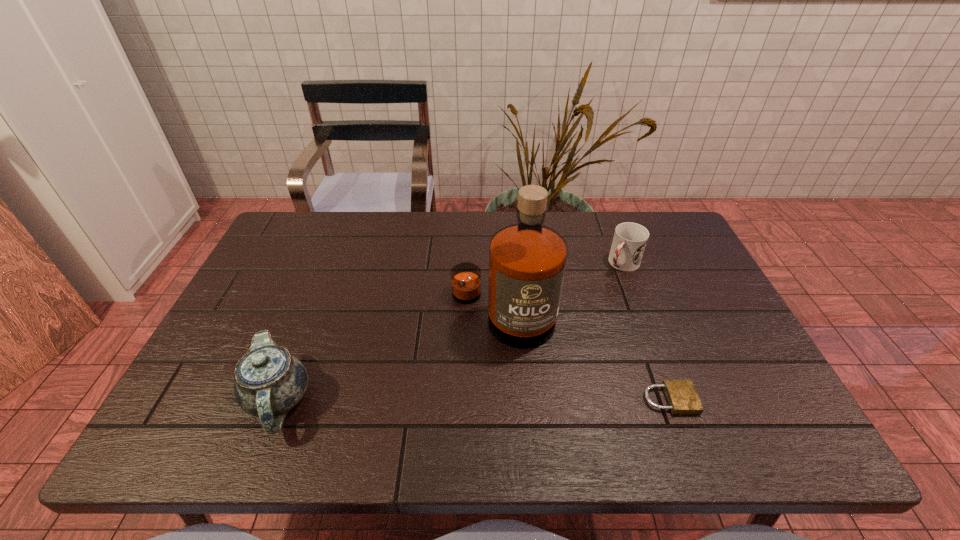
The width and height of the screenshot is (960, 540). I want to click on vacant area in the image that satisfies the following two spatial constraints: 1. from the spout of the leftmost object; 2. on the keyhole side of the shortest object, so click(278, 400).

Where is `free region that satisfies the following two spatial constraints: 1. from the spout of the second tallest object; 2. on the keyhole side of the shortest object`? free region that satisfies the following two spatial constraints: 1. from the spout of the second tallest object; 2. on the keyhole side of the shortest object is located at coordinates (278, 400).

At what (x,y) coordinates should I click in order to perform the action: click on vacant region that satisfies the following two spatial constraints: 1. on the front side of the padlock; 2. on the keyhole side of the liquor. Please return your answer as a coordinate pair (x, y). This screenshot has width=960, height=540. Looking at the image, I should click on (507, 400).